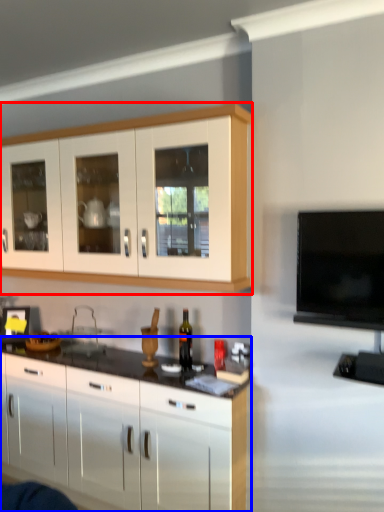
Question: Among these objects, which one is nearest to the camera, cabinetry (highlighted by a red box) or cabinetry (highlighted by a blue box)?

Choices:
 (A) cabinetry
 (B) cabinetry

Answer: (A)